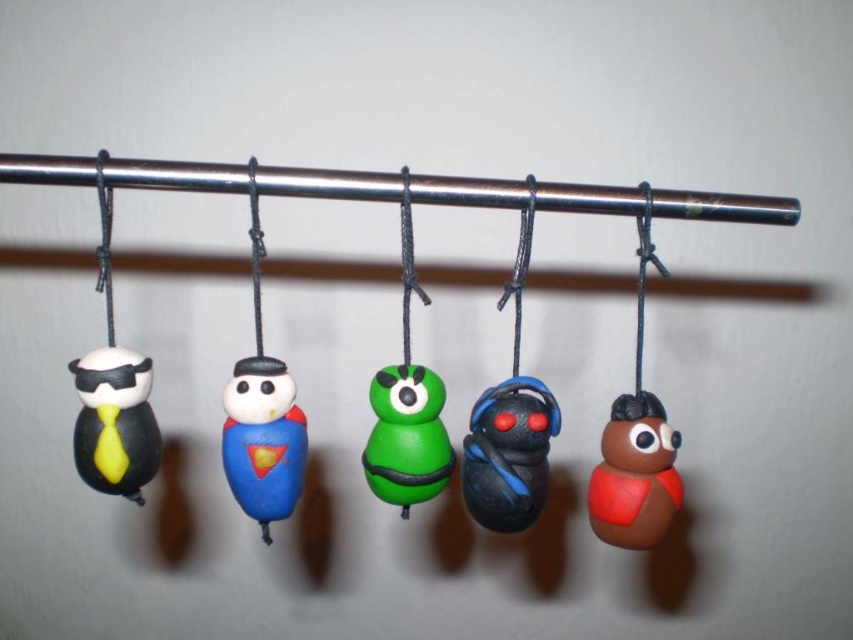
You are standing in front of the display of five small handmade figurines hanging from a horizontal metal rod. You want to reach a specific point at coordinates point (503, 406). If your hand can extend 30 inches forward, will you be able to touch that point?

The distance of point (503, 406) from viewer is 33.45 inches. Since your hand can only extend 30 inches forward, you cannot reach that point.